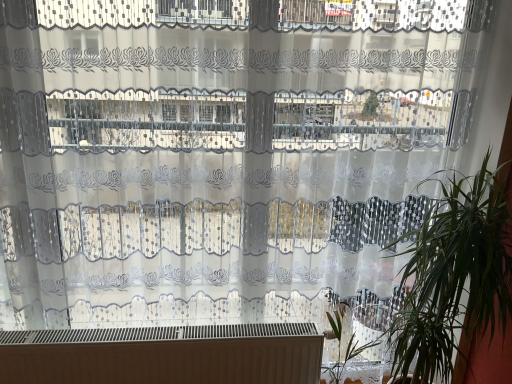
Question: Is white matte heater at bottom taller or shorter than green leafy plant at right?

Choices:
 (A) short
 (B) tall

Answer: (A)

Question: Is white matte heater at bottom to the left or to the right of green leafy plant at right in the image?

Choices:
 (A) left
 (B) right

Answer: (A)

Question: Estimate the real-world distances between objects in this image. Which object is farther from the green leafy plant at right?

Choices:
 (A) green leafy plant at lower right
 (B) white matte heater at bottom

Answer: (B)

Question: Which object is the farthest from the white matte heater at bottom?

Choices:
 (A) green leafy plant at lower right
 (B) green leafy plant at right

Answer: (B)